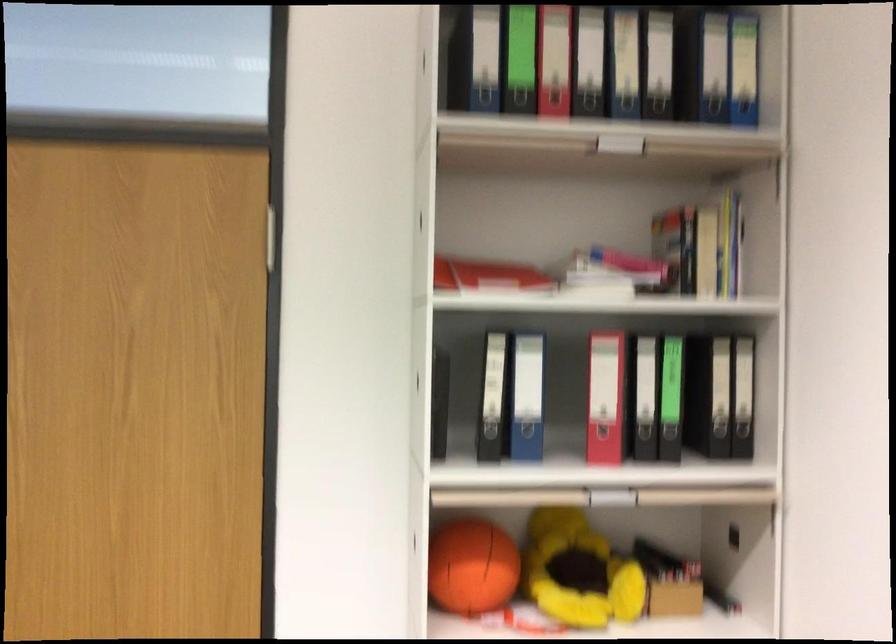
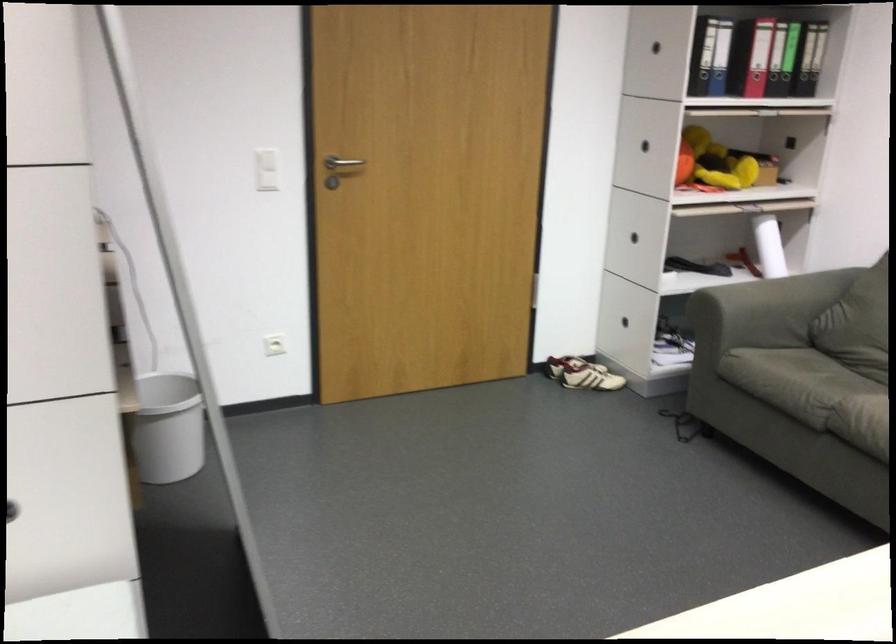
What movement of the cameraman would produce the second image?

The cameraman moved toward left, backward.